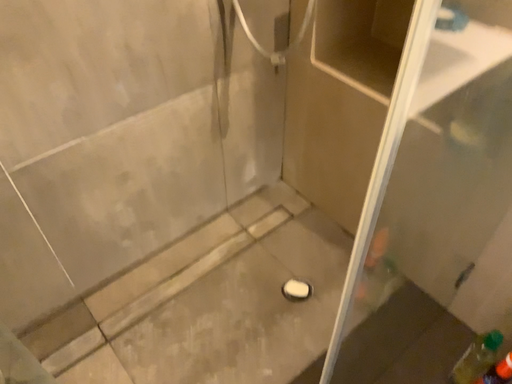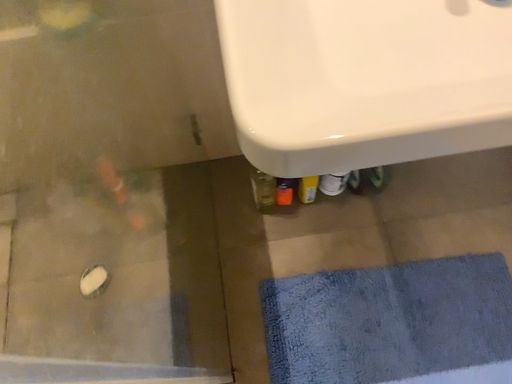
Question: How did the camera likely rotate when shooting the video?

Choices:
 (A) rotated right
 (B) rotated left

Answer: (A)